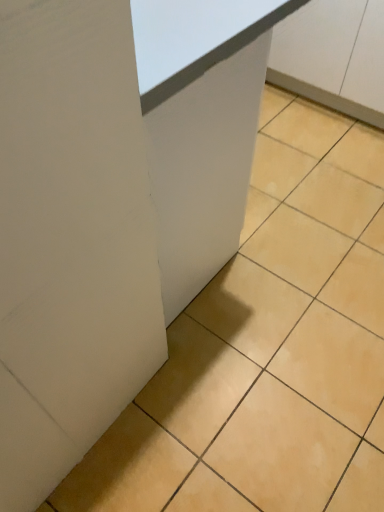
Identify the location of white matte cabinet at upper right. This screenshot has height=512, width=384. (333, 56).

The height and width of the screenshot is (512, 384). What do you see at coordinates (333, 56) in the screenshot? I see `white matte cabinet at upper right` at bounding box center [333, 56].

Identify the location of white matte cabinet at center. Image resolution: width=384 pixels, height=512 pixels. (200, 126).

What do you see at coordinates (200, 126) in the screenshot?
I see `white matte cabinet at center` at bounding box center [200, 126].

Find the location of `white matte cabinet at upper right`. white matte cabinet at upper right is located at coordinates (333, 56).

Which object is positioned more to the left, white matte cabinet at center or white matte cabinet at upper right?

Positioned to the left is white matte cabinet at center.

Does white matte cabinet at center lie in front of white matte cabinet at upper right?

Yes.

Does point (205, 260) come in front of point (301, 34)?

Yes, it is in front of point (301, 34).

Consider the image. From the image's perspective, is white matte cabinet at center above or below white matte cabinet at upper right?

Clearly, from the image's perspective, white matte cabinet at center is below white matte cabinet at upper right.

In the scene shown: From a real-world perspective, is white matte cabinet at center positioned over white matte cabinet at upper right based on gravity?

Indeed, from a real-world perspective, white matte cabinet at center stands above white matte cabinet at upper right.

Looking at their sizes, would you say white matte cabinet at center is wider or thinner than white matte cabinet at upper right?

Clearly, white matte cabinet at center has less width compared to white matte cabinet at upper right.

Considering the relative sizes of white matte cabinet at center and white matte cabinet at upper right in the image provided, is white matte cabinet at center taller than white matte cabinet at upper right?

Yes.

Can you confirm if white matte cabinet at center is bigger than white matte cabinet at upper right?

Indeed, white matte cabinet at center has a larger size compared to white matte cabinet at upper right.

Is white matte cabinet at center not inside white matte cabinet at upper right?

Yes, white matte cabinet at center is outside of white matte cabinet at upper right.

Is white matte cabinet at center placed right next to white matte cabinet at upper right?

No, white matte cabinet at center is not beside white matte cabinet at upper right.

In the scene shown: Could you tell me if white matte cabinet at center is facing white matte cabinet at upper right?

Yes.

What's the angular difference between white matte cabinet at center and white matte cabinet at upper right's facing directions?

There is a 179-degree angle between the facing directions of white matte cabinet at center and white matte cabinet at upper right.

At what (x,y) coordinates should I click in order to perform the action: click on table on the left of white matte cabinet at upper right. Please return your answer as a coordinate pair (x, y). Image resolution: width=384 pixels, height=512 pixels. Looking at the image, I should click on (200, 126).

Which is more to the right, white matte cabinet at upper right or white matte cabinet at center?

From the viewer's perspective, white matte cabinet at upper right appears more on the right side.

Which is in front, white matte cabinet at upper right or white matte cabinet at center?

white matte cabinet at center.

Does point (296, 78) come closer to viewer compared to point (272, 27)?

That is False.

From the image's perspective, does white matte cabinet at upper right appear higher than white matte cabinet at center?

Yes, from the image's perspective, white matte cabinet at upper right is over white matte cabinet at center.

Consider the image. From a real-world perspective, between white matte cabinet at upper right and white matte cabinet at center, who is vertically higher?

white matte cabinet at center.

Considering the sizes of white matte cabinet at upper right and white matte cabinet at center in the image, is white matte cabinet at upper right wider or thinner than white matte cabinet at center?

white matte cabinet at upper right is wider than white matte cabinet at center.

From their relative heights in the image, would you say white matte cabinet at upper right is taller or shorter than white matte cabinet at center?

white matte cabinet at upper right is shorter than white matte cabinet at center.

Who is bigger, white matte cabinet at upper right or white matte cabinet at center?

With larger size is white matte cabinet at center.

Do you think white matte cabinet at upper right is within white matte cabinet at center, or outside of it?

white matte cabinet at upper right cannot be found inside white matte cabinet at center.

Are white matte cabinet at upper right and white matte cabinet at center making contact?

No, white matte cabinet at upper right is not in contact with white matte cabinet at center.

From the picture: Could you tell me if white matte cabinet at upper right is facing white matte cabinet at center?

Yes, white matte cabinet at upper right is oriented towards white matte cabinet at center.

How different are the orientations of white matte cabinet at upper right and white matte cabinet at center in degrees?

179 degrees.

How far apart are white matte cabinet at upper right and white matte cabinet at center?

white matte cabinet at upper right is 1.00 meters from white matte cabinet at center.

At what (x,y) coordinates should I click in order to perform the action: click on cabinetry below the white matte cabinet at center (from a real-world perspective). Please return your answer as a coordinate pair (x, y). The image size is (384, 512). Looking at the image, I should click on (333, 56).

In the image, there is a white matte cabinet at center. Identify the location of cabinetry below it (from a real-world perspective). (333, 56).

The image size is (384, 512). I want to click on cabinetry lying on the right of white matte cabinet at center, so click(333, 56).